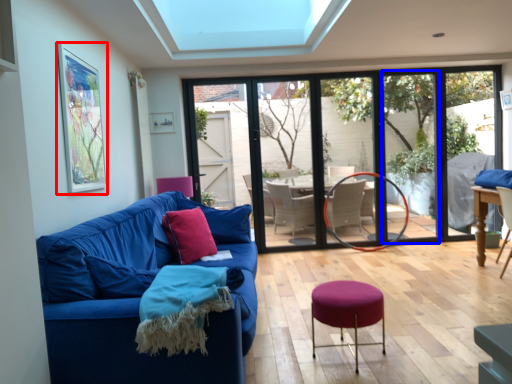
Question: Which object appears closest to the camera in this image, picture frame (highlighted by a red box) or window screen (highlighted by a blue box)?

Choices:
 (A) picture frame
 (B) window screen

Answer: (A)